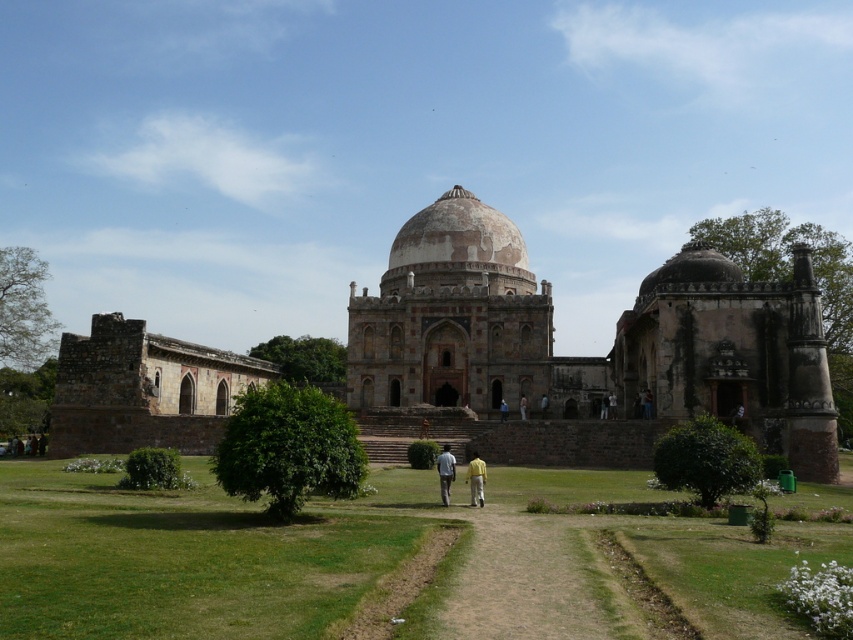
Based on the photo, does green grass at center appear over light blue fabric shirt at center?

Actually, green grass at center is below light blue fabric shirt at center.

Who is more distant from viewer, (136, 544) or (439, 484)?

The point (439, 484) is behind.

You are a GUI agent. You are given a task and a screenshot of the screen. Output one action in this format:
    pyautogui.click(x=<x>, y=<y>)
    Task: Click on the green grass at center
    The width and height of the screenshot is (853, 640).
    Given the screenshot: What is the action you would take?
    pyautogui.click(x=363, y=557)

Is rustic stone palace at center taller than yellow fabric pants at center?

Yes.

Is rustic stone palace at center to the left of yellow fabric pants at center from the viewer's perspective?

No, rustic stone palace at center is not to the left of yellow fabric pants at center.

Where is `rustic stone palace at center`? This screenshot has width=853, height=640. rustic stone palace at center is located at coordinates (590, 356).

Looking at this image, does green grass at center have a lesser width compared to rustic stone palace at center?

No, green grass at center is not thinner than rustic stone palace at center.

Does green grass at center have a greater height compared to rustic stone palace at center?

In fact, green grass at center may be shorter than rustic stone palace at center.

The height and width of the screenshot is (640, 853). In order to click on green grass at center in this screenshot , I will do `click(363, 557)`.

At what (x,y) coordinates should I click in order to perform the action: click on green grass at center. Please return your answer as a coordinate pair (x, y). This screenshot has width=853, height=640. Looking at the image, I should click on (363, 557).